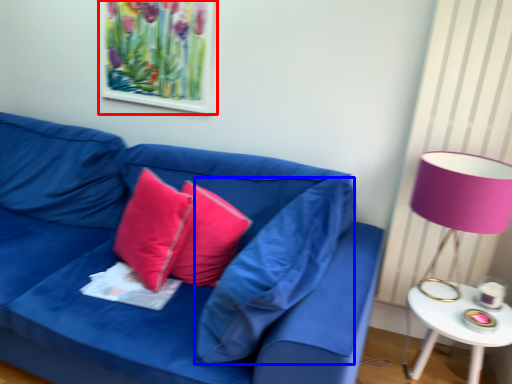
Question: Which object is closer to the camera taking this photo, picture frame (highlighted by a red box) or pillow (highlighted by a blue box)?

Choices:
 (A) picture frame
 (B) pillow

Answer: (B)